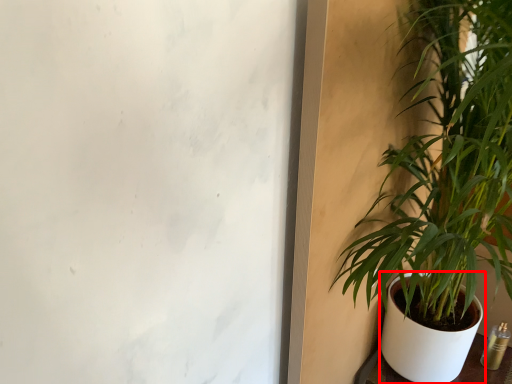
Question: From the image's perspective, what is the correct spatial positioning of flowerpot (annotated by the red box) in reference to houseplant?

Choices:
 (A) below
 (B) above

Answer: (A)